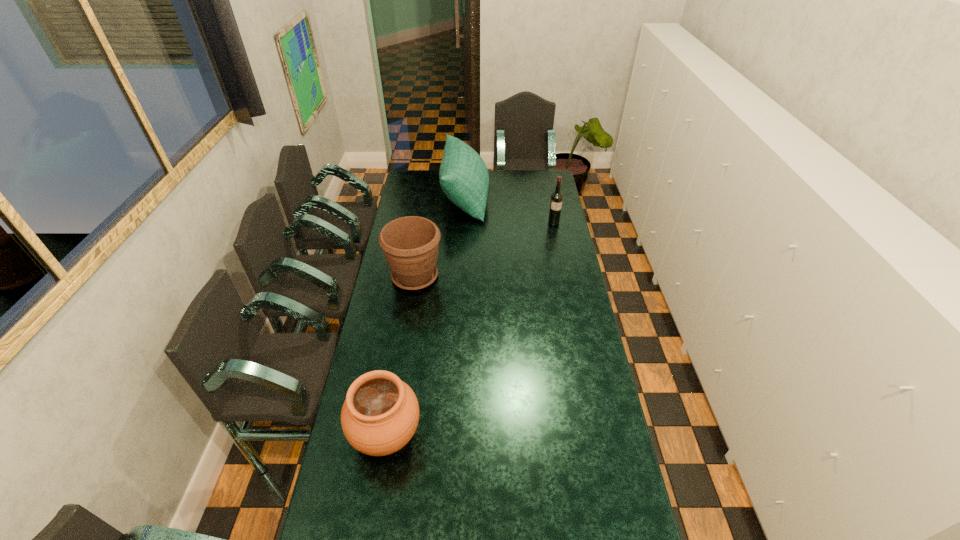
You are a GUI agent. You are given a task and a screenshot of the screen. Output one action in this format:
    pyautogui.click(x=<x>, y=<y>)
    Task: Click on the empty location between the wine bottle and the cushion
    
    Given the screenshot: What is the action you would take?
    pyautogui.click(x=510, y=210)

Find the location of `free spot between the cushion and the pottery`. free spot between the cushion and the pottery is located at coordinates pyautogui.click(x=426, y=316).

Identify which object is the third closest to the nearest object. Please provide its 2D coordinates. Your answer should be formatted as a tuple, i.e. [(x, y)], where the tuple contains the x and y coordinates of a point satisfying the conditions above.

[(556, 198)]

Identify which object is the nearest to the pottery. Please provide its 2D coordinates. Your answer should be formatted as a tuple, i.e. [(x, y)], where the tuple contains the x and y coordinates of a point satisfying the conditions above.

[(410, 244)]